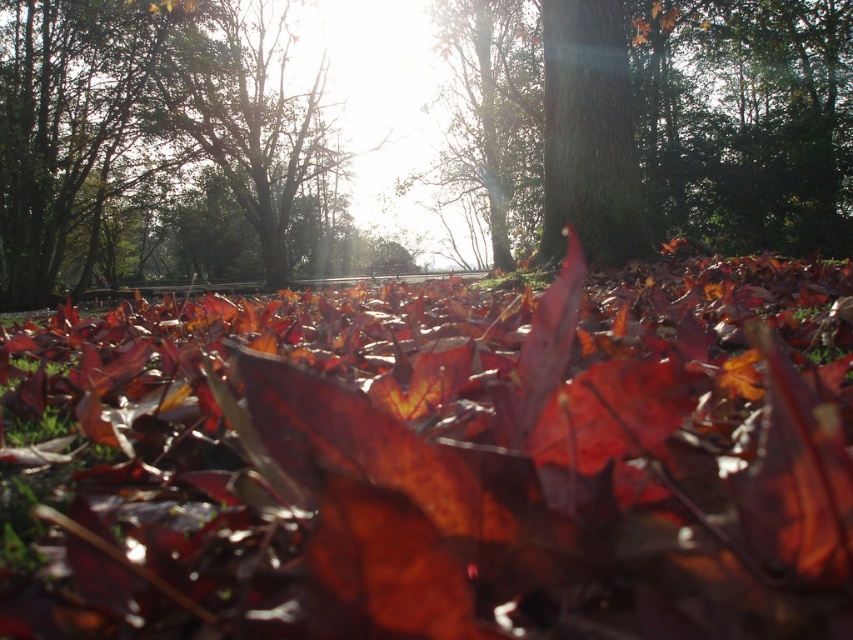
Based on the photo, you are an artist sketching the autumn scene. You notice the shiny red leaves at center and the green rough bark tree at center. Which object would you need to draw with a larger scale in your sketch?

The shiny red leaves at center should be drawn larger in scale compared to the green rough bark tree at center because the shiny red leaves at center is larger in size than the green rough bark tree at center according to the description.

In the scene shown: You are standing in the autumn scene and notice the shiny red leaves at center and the smooth bark tree at center. Which object is closer to the ground?

The shiny red leaves at center are closer to the ground because they are positioned under the smooth bark tree at center.